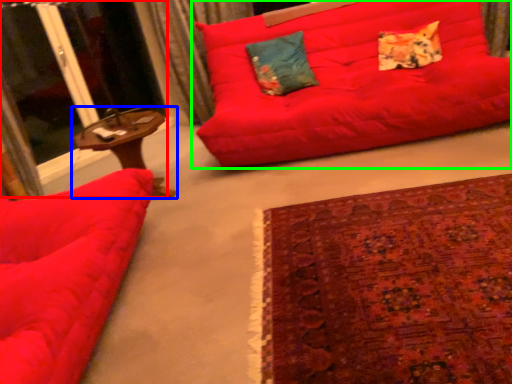
Question: Which object is positioned farthest from screen door (highlighted by a red box)? Select from table (highlighted by a blue box) and studio couch (highlighted by a green box).

Choices:
 (A) table
 (B) studio couch

Answer: (B)